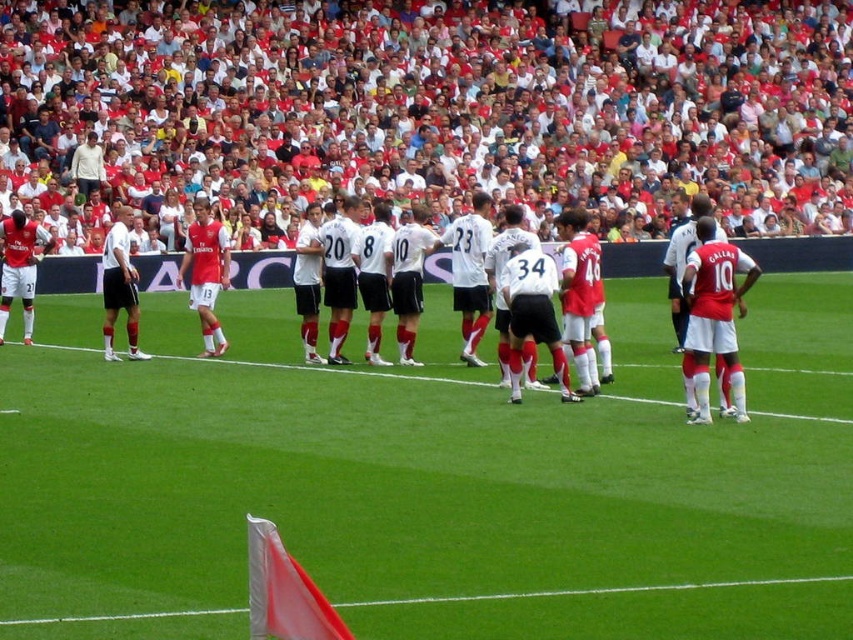
Question: Estimate the real-world distances between objects in this image. Which object is closer to the matte black jersey at left?

Choices:
 (A) white jersey at center
 (B) red fabric corner at lower center

Answer: (A)

Question: Which is nearer to the white jersey at center?

Choices:
 (A) white matte jersey at center
 (B) matte red jersey at center
 (C) green grass field at center
 (D) matte black jersey at left

Answer: (C)

Question: Which point appears closest to the camera in this image?

Choices:
 (A) (202, 262)
 (B) (639, 605)
 (C) (21, 241)
 (D) (741, 394)

Answer: (B)

Question: Is matte black jersey at left positioned in front of white matte jersey at center?

Choices:
 (A) no
 (B) yes

Answer: (A)

Question: Where is matte black jersey at left located in relation to white matte jersey at center in the image?

Choices:
 (A) above
 (B) below

Answer: (A)

Question: Where is white jersey at center located in relation to matte red shorts at right in the image?

Choices:
 (A) above
 (B) below

Answer: (A)